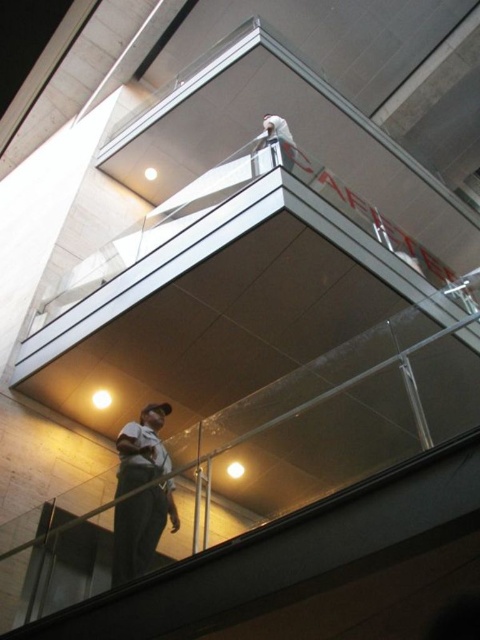
You are standing at the point marked as point (x=156, y=493) in a modern glass and metal staircase structure. You want to take a photo of the lower level where another person is visible. Is the camera positioned close enough to capture the lower level clearly?

The point (x=156, y=493) and the camera are 14.82 feet apart. Since the camera is positioned at this distance, it should be able to capture the lower level clearly as 14.82 feet is a reasonable distance for photography.

You are standing at the top of the glass and metal staircase in the modern architectural structure. You notice two points marked in the scene. Which point, point (127, 525) or point (288, 168), is closer to you?

Point (127, 525) is closer to you than point (288, 168).